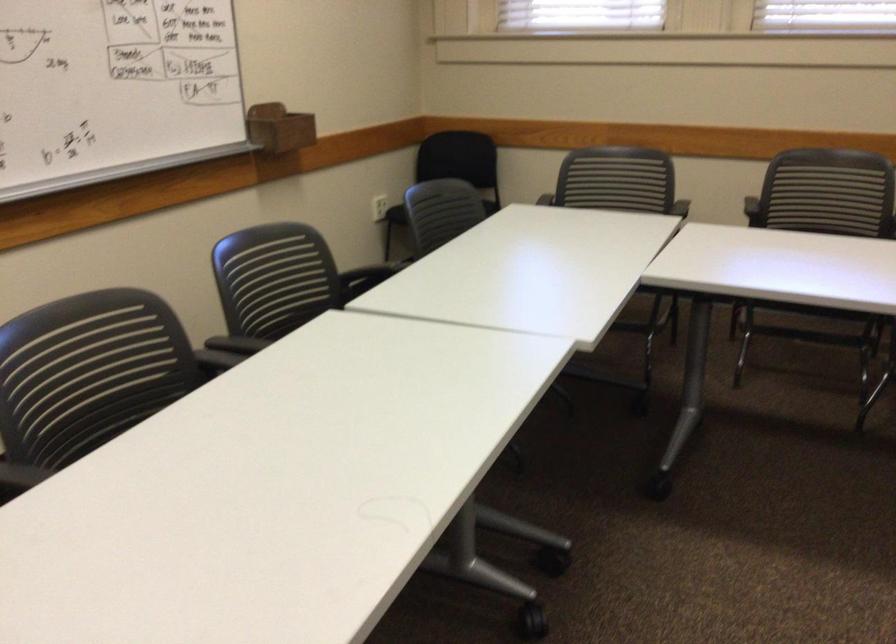
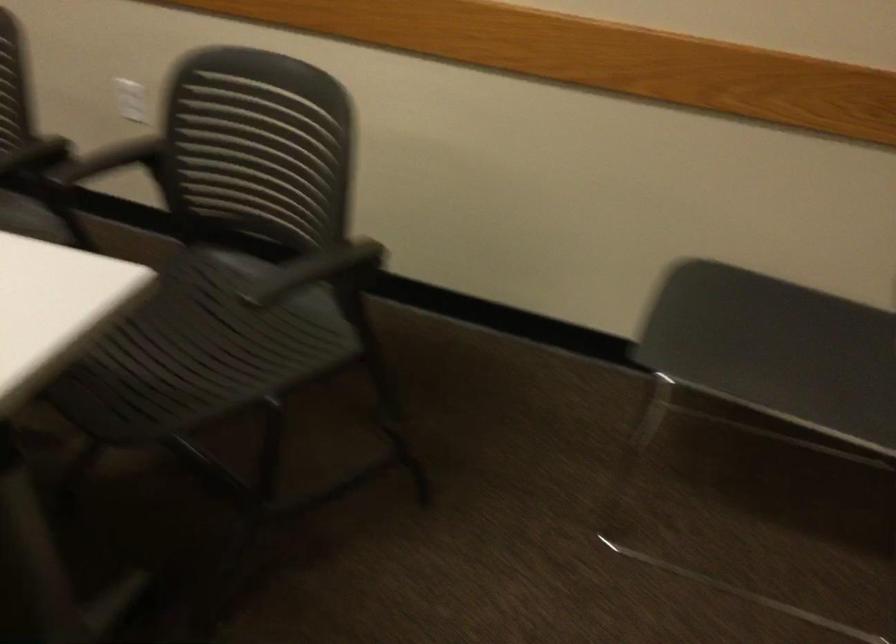
Question: In a continuous first-person perspective shot, in which direction is the camera moving?

Choices:
 (A) Left
 (B) Right
 (C) Forward
 (D) Backward

Answer: (B)